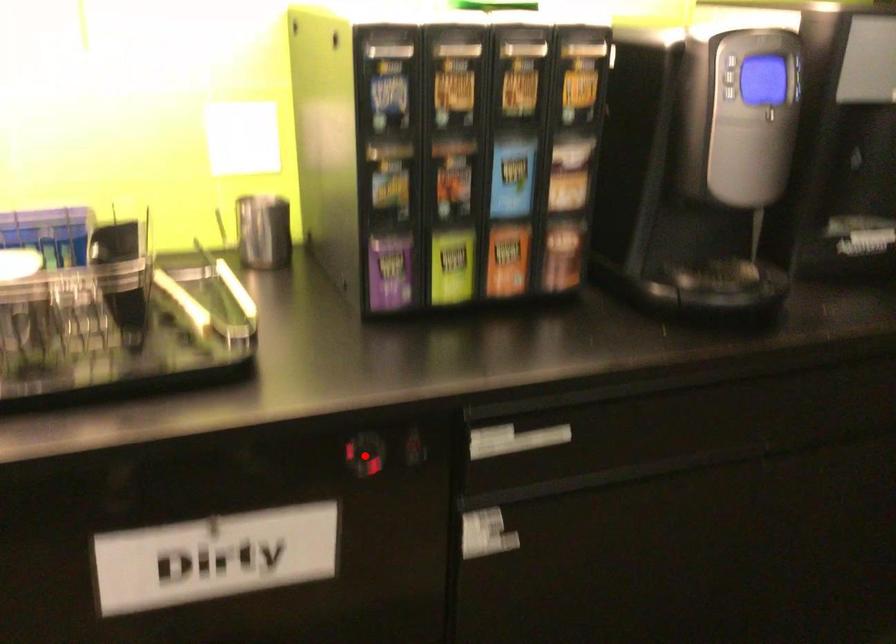
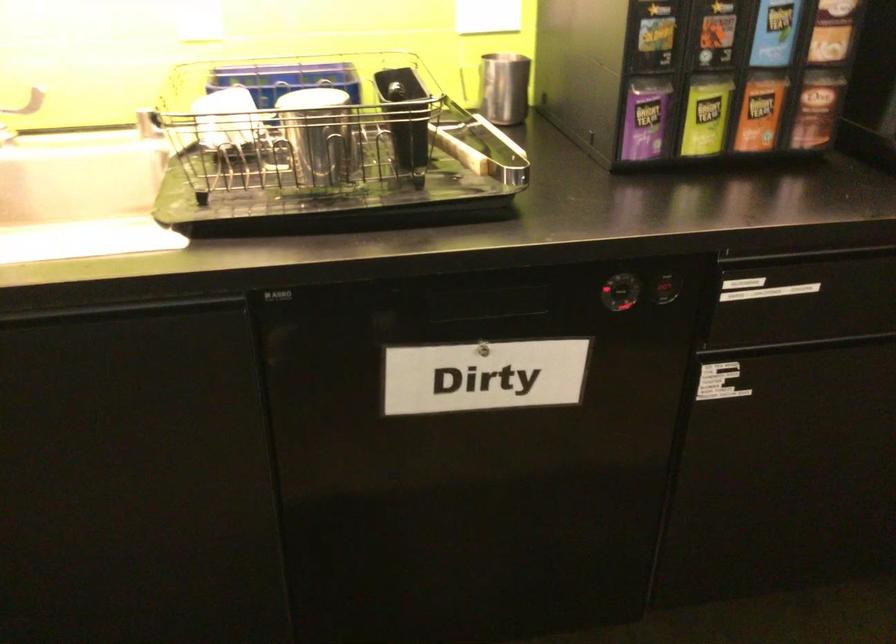
Where in the second image is the point corresponding to the highlighted location from the first image?

(623, 290)